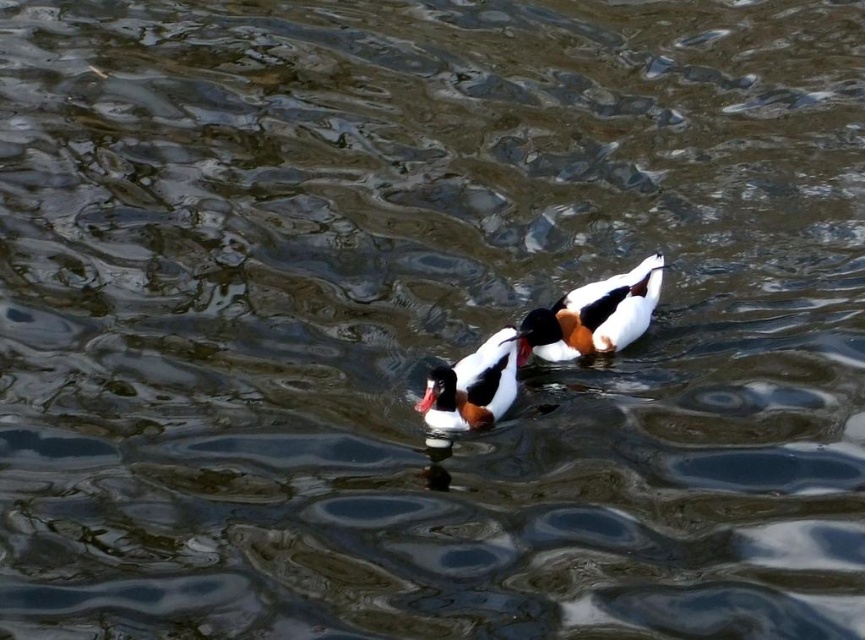
You are a wildlife photographer aiming to capture the white glossy duck at center. Based on its position, which part of the water surface should you focus on to ensure the duck is sharply in the frame?

The white glossy duck at center is located at point (593, 316), so you should focus on the water surface at those coordinates to ensure the duck is sharply in the frame.

You are a photographer trying to capture both the white glossy duck at center and the white fluffy duck at center in a single shot. Since you want to highlight their height difference, which duck should you focus on first to ensure the taller one is in frame?

The white glossy duck at center is much taller than the white fluffy duck at center, so you should focus on the white glossy duck at center first to ensure the taller one is in frame.

Consider the image. You are observing two ducks in the water. There is a white glossy duck at center and a white fluffy duck at center. Which duck is positioned to the right of the other?

The white glossy duck at center is positioned to the right of the white fluffy duck at center.